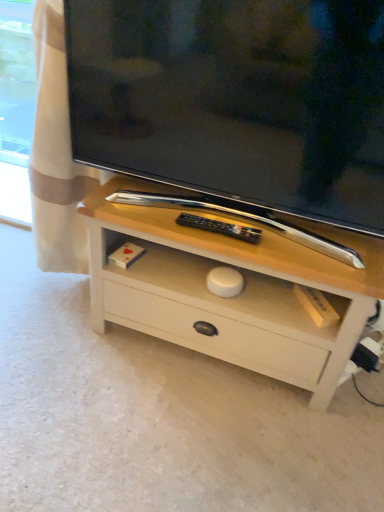
The width and height of the screenshot is (384, 512). I want to click on vacant region above white painted wood chest of drawers at center (from a real-world perspective), so (242, 225).